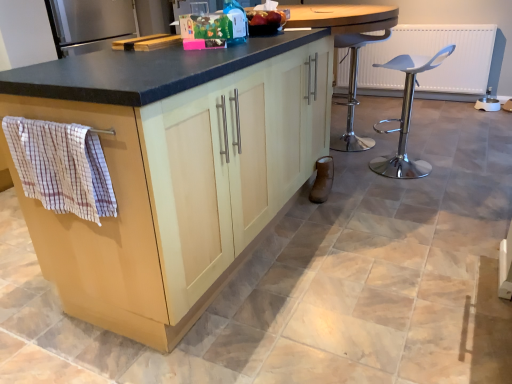
Locate an element on the screen. free space underneath white plastic stool at right (from a real-world perspective) is located at coordinates (400, 172).